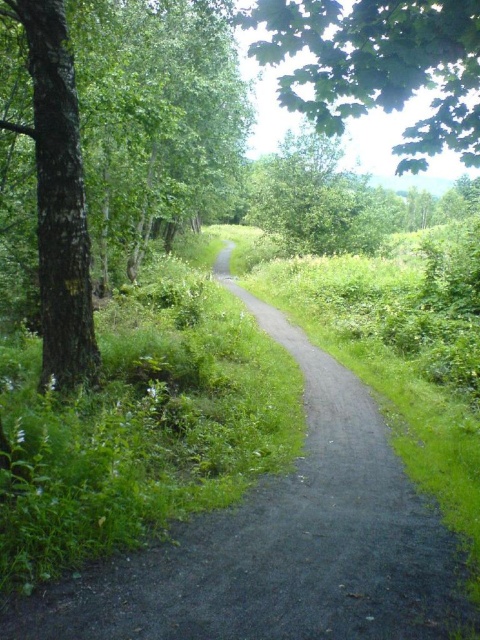
You are standing at the point marked by the coordinates point (377, 67). Looking towards the winding dirt path meandering through the lush green landscape, which direction should you walk to stay on the path as it curves gently to the right?

Since the path curves gently to the right, you should walk in the direction that follows the curve to the right to stay on the path.